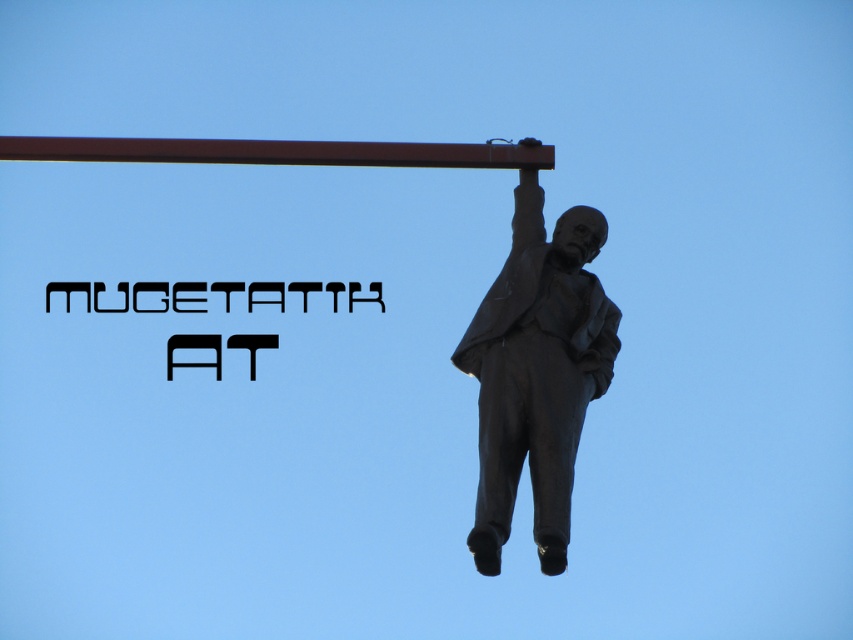
Does bronze statue at upper right have a larger size compared to brown metal pole at upper center?

Yes, bronze statue at upper right is bigger than brown metal pole at upper center.

Which of these two, bronze statue at upper right or brown metal pole at upper center, stands shorter?

brown metal pole at upper center

What do you see at coordinates (537, 372) in the screenshot?
I see `bronze statue at upper right` at bounding box center [537, 372].

This screenshot has width=853, height=640. I want to click on bronze statue at upper right, so click(537, 372).